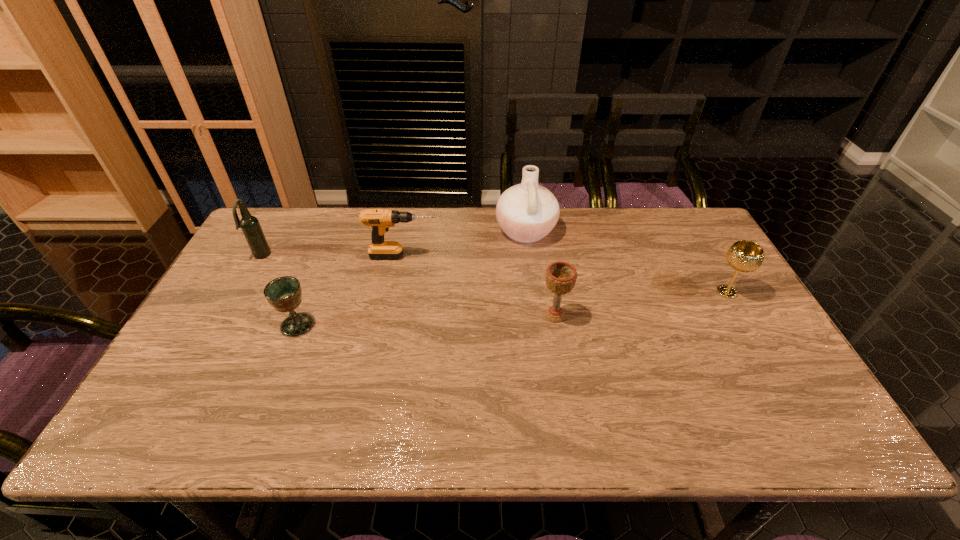
Identify the location of object that is positioned at the far left corner. Image resolution: width=960 pixels, height=540 pixels. (251, 228).

Find the location of a particular element. The width and height of the screenshot is (960, 540). free space at the far edge is located at coordinates coord(565,248).

This screenshot has height=540, width=960. I want to click on vacant space at the near edge of the desktop, so click(x=508, y=444).

This screenshot has height=540, width=960. In the image, there is a desktop. What are the coordinates of `free space at the left edge` in the screenshot? It's located at (227, 274).

The width and height of the screenshot is (960, 540). In order to click on vacant space at the right edge of the desktop in this screenshot , I will do `click(746, 399)`.

This screenshot has width=960, height=540. In the image, there is a desktop. Identify the location of vacant space at the far left corner. (282, 238).

The width and height of the screenshot is (960, 540). What are the coordinates of `unoccupied position between the farthest chalice and the second chalice from left to right` in the screenshot? It's located at (640, 304).

Locate an element on the screen. Image resolution: width=960 pixels, height=540 pixels. empty space between the drill and the leftmost chalice is located at coordinates (350, 291).

At what (x,y) coordinates should I click in order to perform the action: click on vacant area that lies between the second chalice from left to right and the pottery. Please return your answer as a coordinate pair (x, y). This screenshot has width=960, height=540. Looking at the image, I should click on (540, 273).

Find the location of a particular element. free space between the second chalice from right to left and the leftmost object is located at coordinates (408, 286).